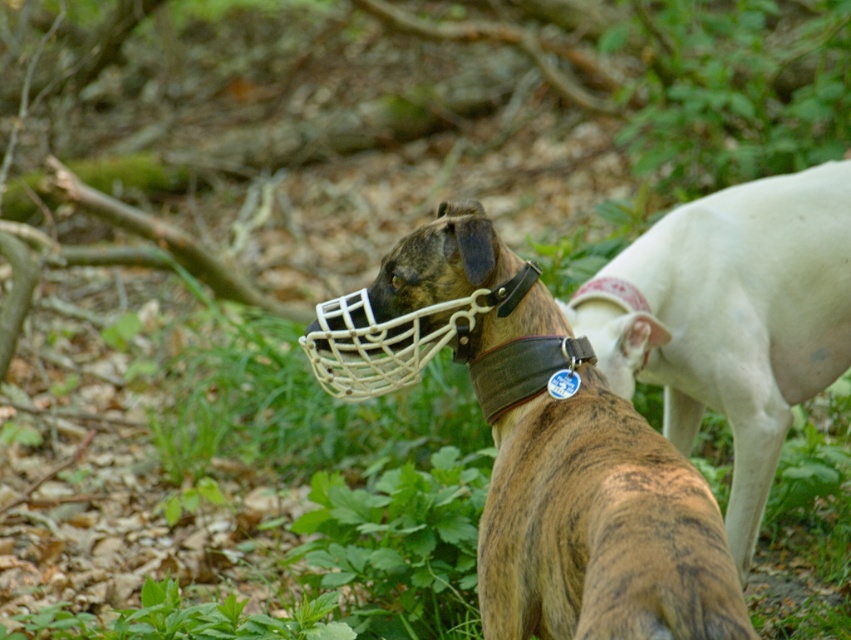
Question: Is brown brindle dog at center to the right of brown canvas collar at center from the viewer's perspective?

Choices:
 (A) no
 (B) yes

Answer: (A)

Question: Which point is farther from the camera taking this photo?

Choices:
 (A) (497, 406)
 (B) (518, 289)

Answer: (A)

Question: Among these objects, which one is nearest to the camera?

Choices:
 (A) brown canvas collar at center
 (B) brown brindle dog at center

Answer: (B)

Question: In this image, where is white smooth dog at right located relative to brown canvas collar at center?

Choices:
 (A) right
 (B) left

Answer: (A)

Question: Can you confirm if brown brindle dog at center is positioned above brown canvas collar at center?

Choices:
 (A) no
 (B) yes

Answer: (A)

Question: Which object appears farthest from the camera in this image?

Choices:
 (A) white smooth dog at right
 (B) brown brindle dog at center

Answer: (A)